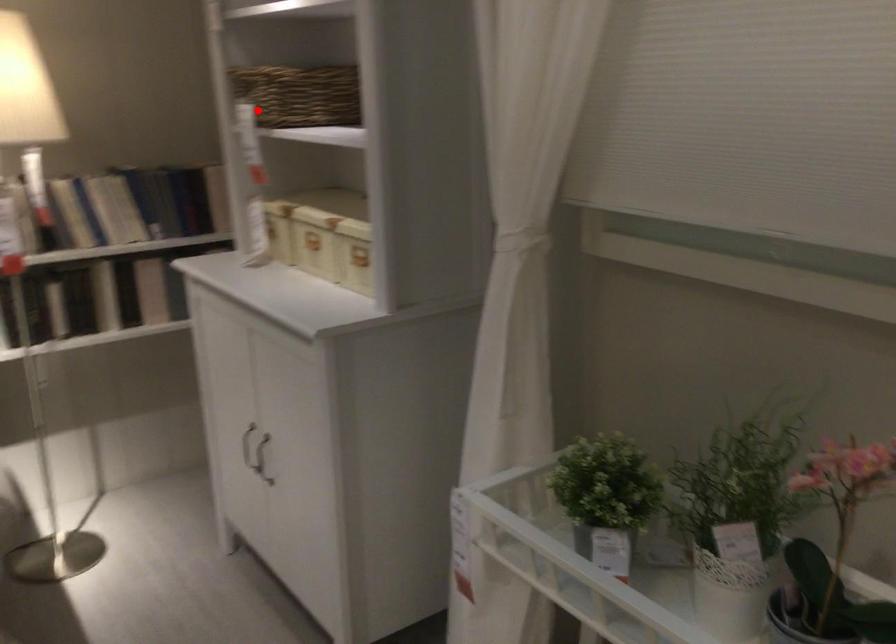
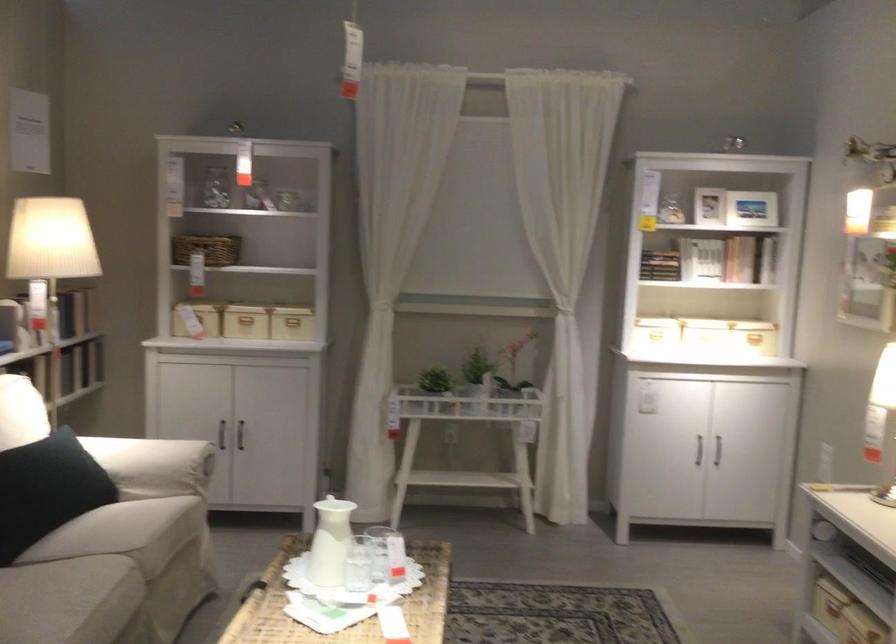
Where in the second image is the point corresponding to the highlighted location from the first image?

(207, 249)